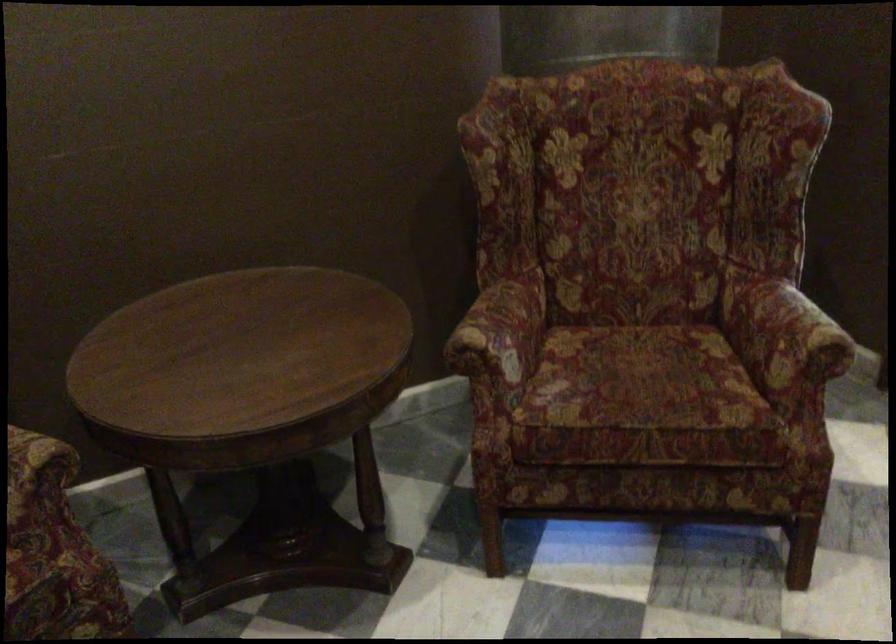
The height and width of the screenshot is (644, 896). In order to click on chair sitting surface in this screenshot , I will do `click(642, 381)`.